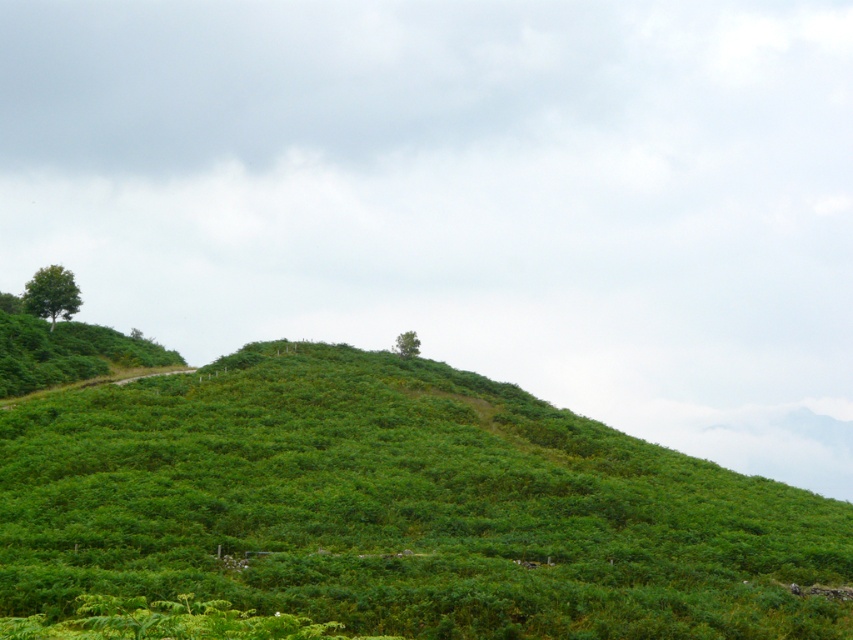
Question: Which object appears closest to the camera in this image?

Choices:
 (A) green leafy hillside at center
 (B) green leafy tree at upper left

Answer: (A)

Question: Which object appears closest to the camera in this image?

Choices:
 (A) green leafy tree at upper center
 (B) green leafy tree at upper left

Answer: (B)

Question: Does green leafy hillside at center come in front of green leafy tree at upper center?

Choices:
 (A) yes
 (B) no

Answer: (A)

Question: Among these points, which one is farthest from the camera?

Choices:
 (A) (51, 291)
 (B) (410, 340)

Answer: (B)

Question: Is green leafy tree at upper left thinner than green leafy tree at upper center?

Choices:
 (A) no
 (B) yes

Answer: (A)

Question: Can you confirm if green leafy hillside at center is positioned to the right of green leafy tree at upper left?

Choices:
 (A) yes
 (B) no

Answer: (A)